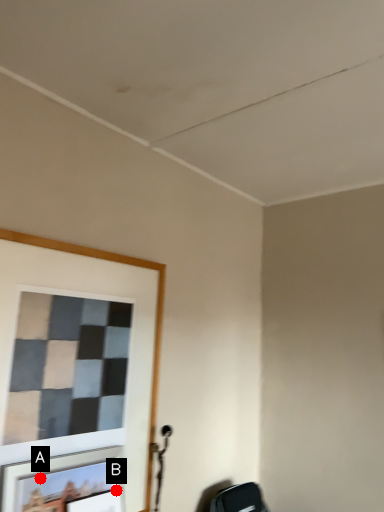
Question: Two points are circled on the image, labeled by A and B beside each circle. Among these points, which one is farthest from the camera?

Choices:
 (A) A is further
 (B) B is further

Answer: (B)